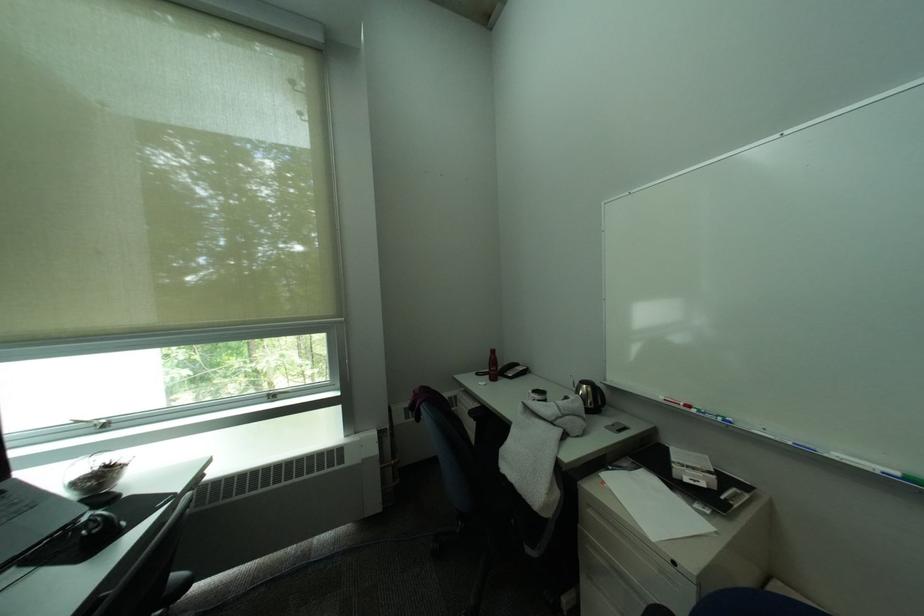
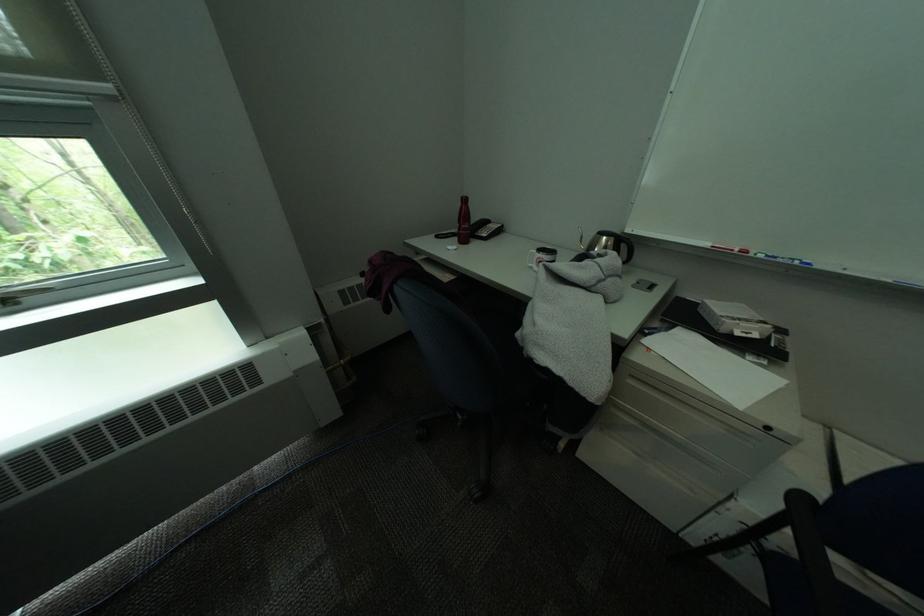
The point at (503, 370) is marked in the first image. Where is the corresponding point in the second image?

(475, 228)